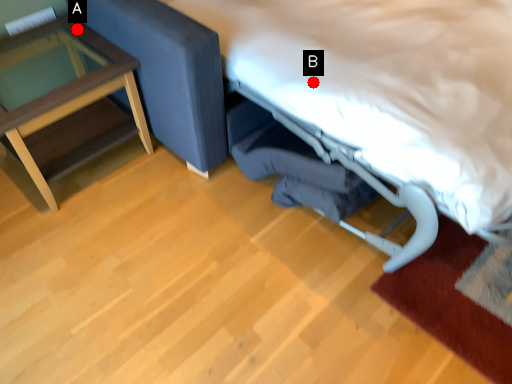
Question: Two points are circled on the image, labeled by A and B beside each circle. Which point is closer to the camera?

Choices:
 (A) A is closer
 (B) B is closer

Answer: (B)